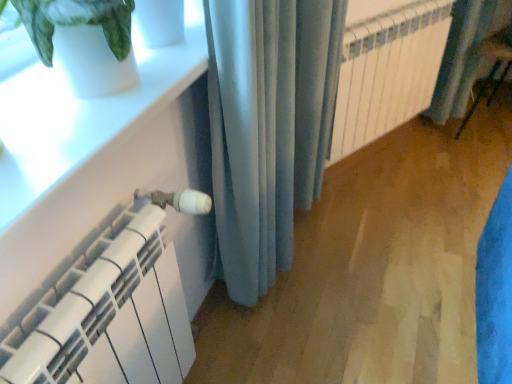
Locate an element on the screen. The image size is (512, 384). vacant area that is in front of satin blue curtain at center, the second curtain in the right-to-left sequence is located at coordinates (271, 343).